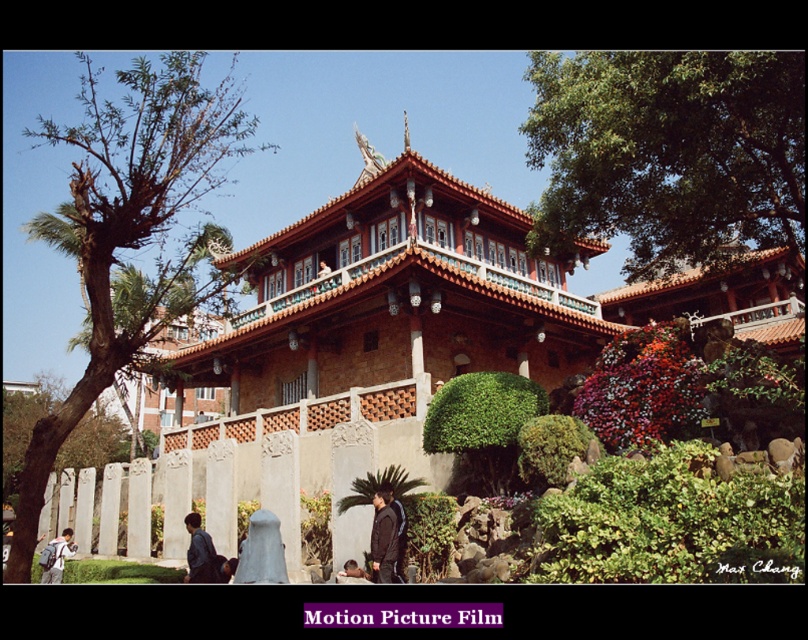
Consider the image. Does green leafy tree at upper right have a lesser height compared to dark brown leather jacket at center?

No.

Which is in front, point (636, 156) or point (383, 520)?

Point (383, 520)

Who is more distant from viewer, (659, 147) or (381, 493)?

The point (659, 147) is more distant.

In order to click on green leafy tree at upper right in this screenshot , I will do `click(668, 150)`.

Can you confirm if green leafy tree at upper right is shorter than brown leafy tree at left?

Yes.

Is green leafy tree at upper right bigger than brown leafy tree at left?

No.

You are a GUI agent. You are given a task and a screenshot of the screen. Output one action in this format:
    pyautogui.click(x=<x>, y=<y>)
    Task: Click on the green leafy tree at upper right
    The height and width of the screenshot is (640, 808).
    Given the screenshot: What is the action you would take?
    pyautogui.click(x=668, y=150)

Identify the location of green leafy tree at upper right. (668, 150).

Can you confirm if dark blue jacket at lower left is positioned above light blue denim jacket at lower left?

Correct, dark blue jacket at lower left is located above light blue denim jacket at lower left.

Can you confirm if dark blue jacket at lower left is smaller than light blue denim jacket at lower left?

Yes, dark blue jacket at lower left is smaller than light blue denim jacket at lower left.

Where is `dark blue jacket at lower left`? This screenshot has height=640, width=808. dark blue jacket at lower left is located at coordinates (204, 556).